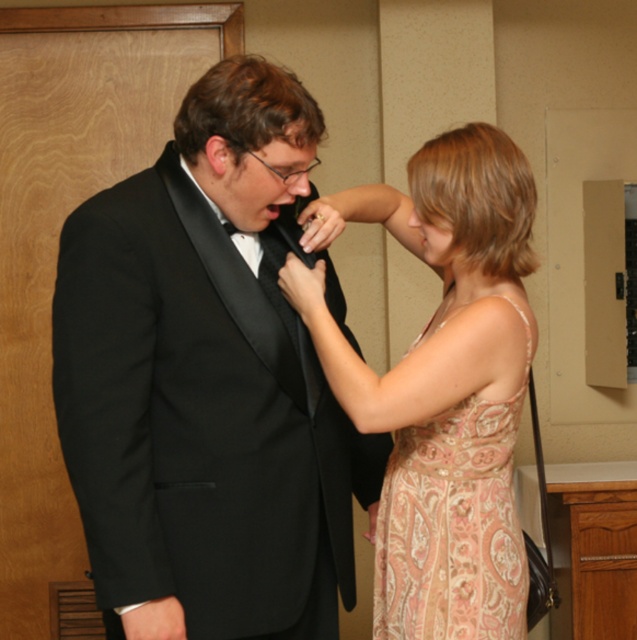
Image resolution: width=637 pixels, height=640 pixels. What do you see at coordinates (208, 381) in the screenshot?
I see `black satin tuxedo at center` at bounding box center [208, 381].

Is black satin tuxedo at center positioned in front of black satin bow tie at center?

Yes, it is in front of black satin bow tie at center.

Who is more forward, (257, 492) or (234, 234)?

Point (257, 492) is more forward.

Locate an element on the screen. The height and width of the screenshot is (640, 637). black satin tuxedo at center is located at coordinates (208, 381).

Can you confirm if paisley silk dress at center is positioned below black satin bow tie at center?

Correct, paisley silk dress at center is located below black satin bow tie at center.

Is point (392, 225) farther from viewer compared to point (233, 225)?

Yes.

Image resolution: width=637 pixels, height=640 pixels. I want to click on paisley silk dress at center, so click(445, 381).

Measure the distance between black satin tuxedo at center and camera.

4.89 feet

Can you confirm if black satin tuxedo at center is bigger than paisley silk dress at center?

Indeed, black satin tuxedo at center has a larger size compared to paisley silk dress at center.

Which is in front, point (217, 195) or point (394, 624)?

Point (217, 195)

Identify the location of black satin tuxedo at center. (208, 381).